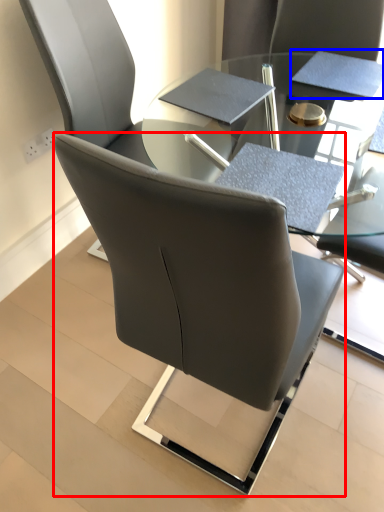
Question: Which object is closer to the camera taking this photo, chair (highlighted by a red box) or notepad (highlighted by a blue box)?

Choices:
 (A) chair
 (B) notepad

Answer: (A)